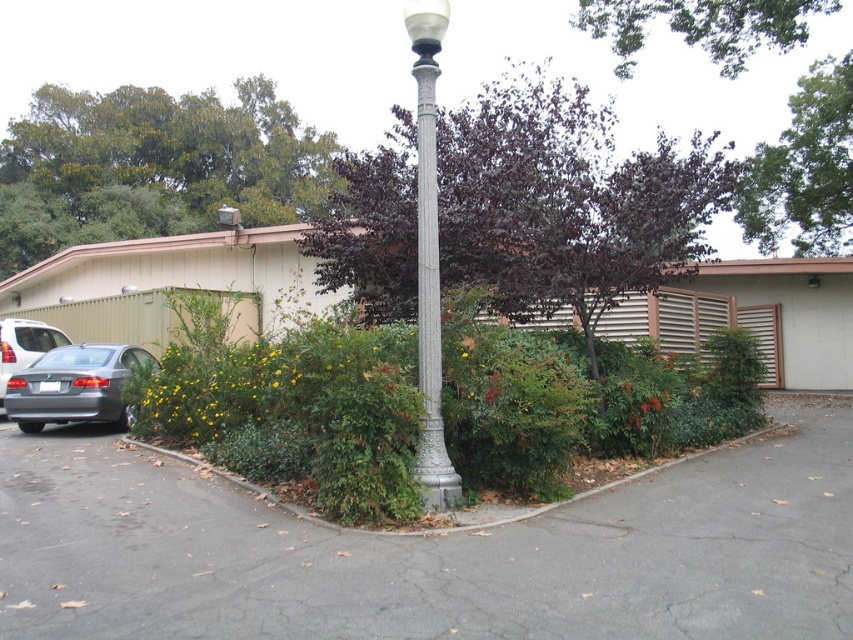
Which of these two, purple-leaved tree at center or satin silver car at left, stands shorter?

satin silver car at left

Is purple-leaved tree at center thinner than satin silver car at left?

No.

Is point (706, 173) farther from camera compared to point (10, 356)?

That is False.

At what (x,y) coordinates should I click in order to perform the action: click on purple-leaved tree at center. Please return your answer as a coordinate pair (x, y). Looking at the image, I should click on [566, 204].

Can you confirm if silver textured street light at center is bigger than satin silver car at left?

Indeed, silver textured street light at center has a larger size compared to satin silver car at left.

Is point (427, 104) behind point (47, 326)?

No, it is not.

Identify the location of silver textured street light at center. (x=428, y=256).

Is purple-leaved tree at center thinner than dark purple leafy tree at upper center?

Incorrect, purple-leaved tree at center's width is not less than dark purple leafy tree at upper center's.

Does point (389, 152) lie behind point (766, 198)?

That is False.

Does point (635, 189) come in front of point (840, 250)?

Yes, it is.

At what (x,y) coordinates should I click in order to perform the action: click on purple-leaved tree at center. Please return your answer as a coordinate pair (x, y). Looking at the image, I should click on [x=566, y=204].